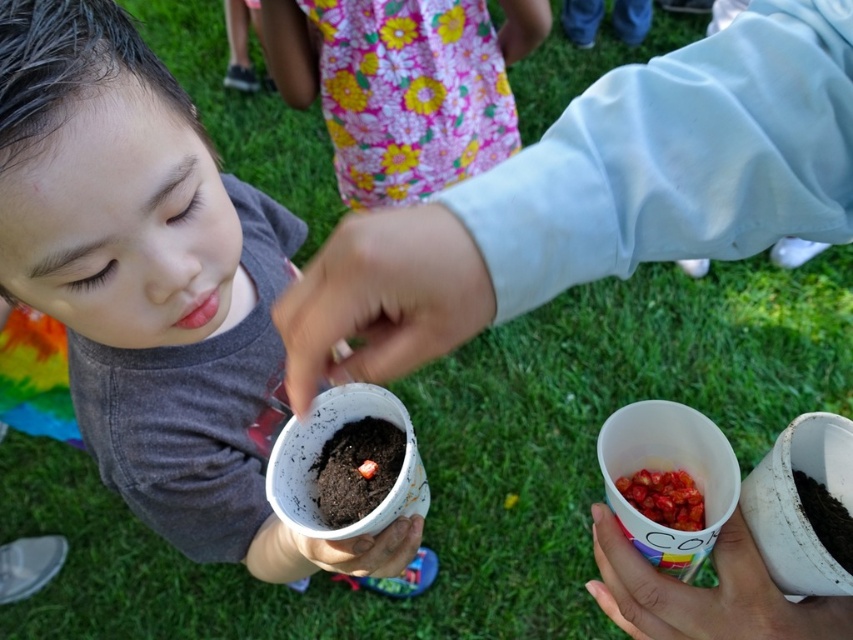
Who is positioned more to the left, matte gray shirt at center or brown soil seed at center?

From the viewer's perspective, matte gray shirt at center appears more on the left side.

Who is higher up, matte gray shirt at center or brown soil seed at center?

matte gray shirt at center is above.

Where is `matte gray shirt at center`? The width and height of the screenshot is (853, 640). matte gray shirt at center is located at coordinates (x=146, y=275).

Does brown soil seed at center have a greater width compared to matte plastic cup at lower center?

No, brown soil seed at center is not wider than matte plastic cup at lower center.

Which is in front, point (310, 467) or point (405, 547)?

Point (405, 547) is in front.

Where is `brown soil seed at center`? brown soil seed at center is located at coordinates click(357, 468).

Is matte gray shirt at center to the right of smooth skin at center from the viewer's perspective?

Incorrect, matte gray shirt at center is not on the right side of smooth skin at center.

Is matte gray shirt at center closer to camera compared to smooth skin at center?

No, matte gray shirt at center is further to the viewer.

Measure the distance between point (296, 244) and camera.

4.10 feet

Where is `matte gray shirt at center`? matte gray shirt at center is located at coordinates (146, 275).